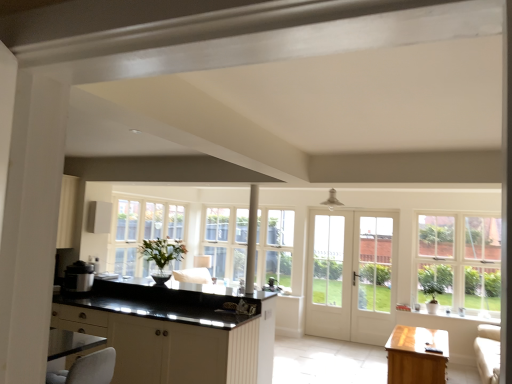
Question: From a real-world perspective, is light brown wooden table at lower right over white glass door at center, placed as the first screen door when sorted from left to right?

Choices:
 (A) yes
 (B) no

Answer: (B)

Question: Is light brown wooden table at lower right looking in the opposite direction of white glass door at center, placed as the first screen door when sorted from left to right?

Choices:
 (A) no
 (B) yes

Answer: (A)

Question: Can you confirm if light brown wooden table at lower right is taller than white glass door at center, which is counted as the second screen door, starting from the right?

Choices:
 (A) yes
 (B) no

Answer: (B)

Question: From the image's perspective, is light brown wooden table at lower right located beneath white glass door at center, which is counted as the second screen door, starting from the right?

Choices:
 (A) yes
 (B) no

Answer: (A)

Question: Considering the relative sizes of light brown wooden table at lower right and white glass door at center, which is counted as the second screen door, starting from the right, in the image provided, is light brown wooden table at lower right thinner than white glass door at center, which is counted as the second screen door, starting from the right,?

Choices:
 (A) yes
 (B) no

Answer: (B)

Question: In terms of width, does clear glass window at right look wider or thinner when compared to white glass door at center?

Choices:
 (A) wide
 (B) thin

Answer: (A)

Question: Is clear glass window at right inside or outside of white glass door at center?

Choices:
 (A) inside
 (B) outside

Answer: (B)

Question: Does point (463, 311) appear closer or farther from the camera than point (393, 291)?

Choices:
 (A) farther
 (B) closer

Answer: (B)

Question: Looking at the image, does clear glass window at right seem bigger or smaller compared to white glass door at center?

Choices:
 (A) small
 (B) big

Answer: (A)

Question: Looking at their shapes, would you say white glass door at center is wider or thinner than clear glass window at right?

Choices:
 (A) thin
 (B) wide

Answer: (A)

Question: Looking at the image, does white glass door at center seem bigger or smaller compared to clear glass window at right?

Choices:
 (A) big
 (B) small

Answer: (A)

Question: From a real-world perspective, is white glass door at center above or below clear glass window at right?

Choices:
 (A) below
 (B) above

Answer: (A)

Question: In the image, is white glass door at center positioned in front of or behind clear glass window at right?

Choices:
 (A) behind
 (B) front

Answer: (A)

Question: In terms of width, does white glass door at center look wider or thinner when compared to matte black rice cooker at left?

Choices:
 (A) thin
 (B) wide

Answer: (A)

Question: Would you say white glass door at center is inside or outside matte black rice cooker at left?

Choices:
 (A) inside
 (B) outside

Answer: (B)